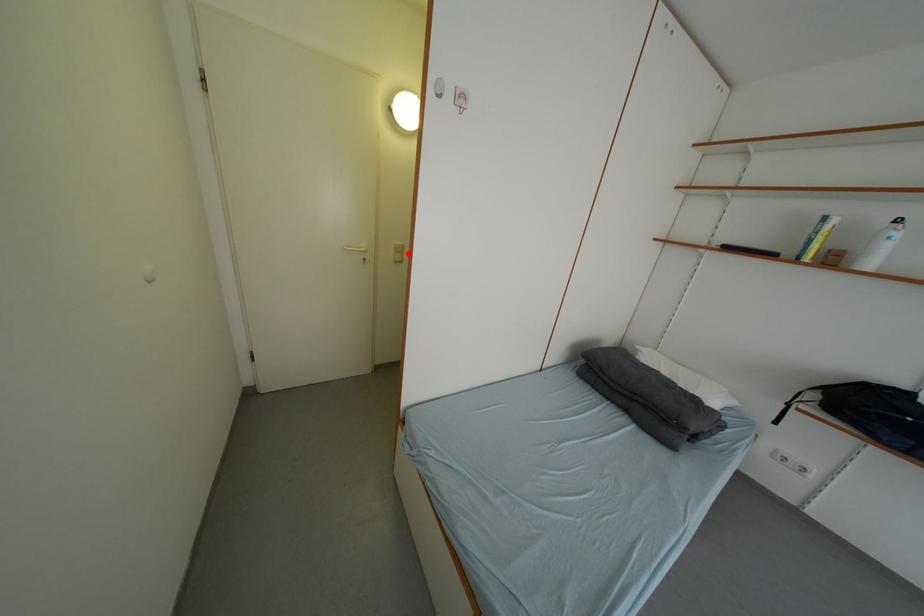
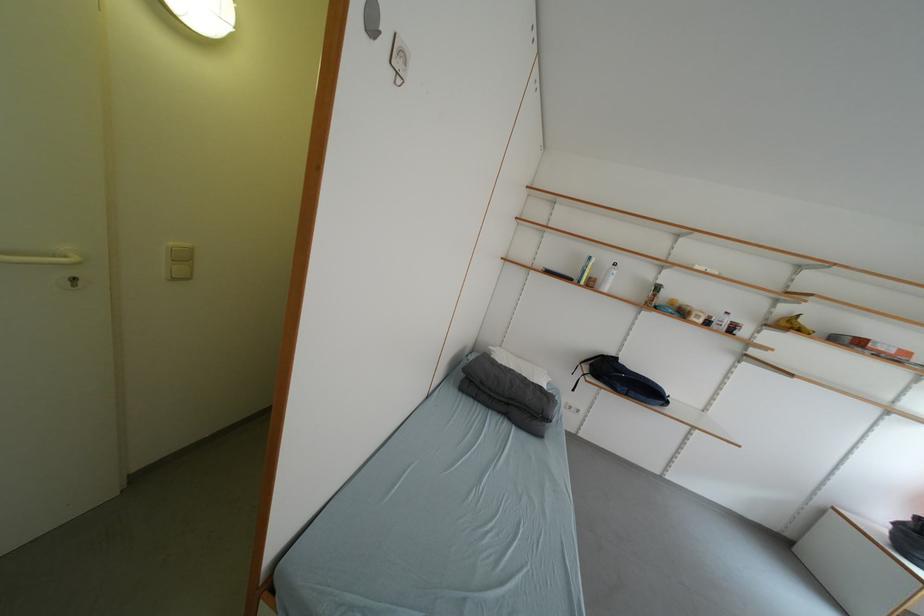
Question: I am providing you with two images of the same scene from different viewpoints. Given a red point in image1, look at the same physical point in image2. Is it:

Choices:
 (A) Closer to the viewpoint
 (B) Farther from the viewpoint

Answer: (A)